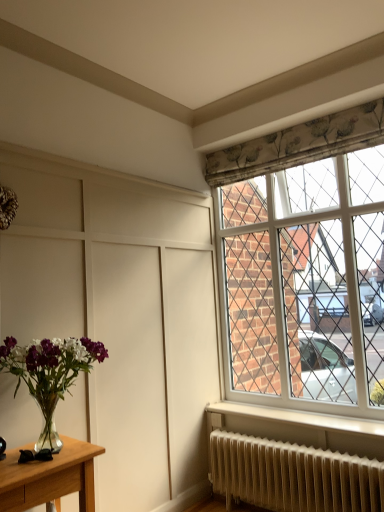
In order to face clear glass vase at lower left, should I rotate leftwards or rightwards?

To face it directly, rotate left by 18.483 degrees.

Identify the location of white plastic window at upper right. (305, 263).

What do you see at coordinates (305, 263) in the screenshot? Image resolution: width=384 pixels, height=512 pixels. I see `white plastic window at upper right` at bounding box center [305, 263].

Identify the location of clear glass vase at lower left. This screenshot has height=512, width=384. (50, 374).

From a real-world perspective, is white textured radiator at lower right over white plastic window at upper right?

No, from a real-world perspective, white textured radiator at lower right is not on top of white plastic window at upper right.

Looking at this image, which of these two, white textured radiator at lower right or white plastic window at upper right, is thinner?

white plastic window at upper right is thinner.

Is white textured radiator at lower right facing towards white plastic window at upper right?

No.

Considering the positions of points (288, 510) and (284, 374), is point (288, 510) closer to camera compared to point (284, 374)?

Yes, point (288, 510) is in front of point (284, 374).

Is clear glass vase at lower left not inside white plastic window at upper right?

Yes, clear glass vase at lower left is outside of white plastic window at upper right.

Which object is positioned more to the right, clear glass vase at lower left or white plastic window at upper right?

From the viewer's perspective, white plastic window at upper right appears more on the right side.

Is clear glass vase at lower left in front of or behind white plastic window at upper right in the image?

clear glass vase at lower left is in front of white plastic window at upper right.

Considering the relative sizes of white textured radiator at lower right and clear glass vase at lower left in the image provided, is white textured radiator at lower right bigger than clear glass vase at lower left?

Indeed, white textured radiator at lower right has a larger size compared to clear glass vase at lower left.

From the image's perspective, which is below, white textured radiator at lower right or clear glass vase at lower left?

white textured radiator at lower right appears lower in the image.

Can you confirm if white textured radiator at lower right is taller than clear glass vase at lower left?

Incorrect, the height of white textured radiator at lower right is not larger of that of clear glass vase at lower left.

Based on the photo, is white textured radiator at lower right spatially inside clear glass vase at lower left, or outside of it?

white textured radiator at lower right is outside clear glass vase at lower left.

Is white plastic window at upper right taller than clear glass vase at lower left?

Correct, white plastic window at upper right is much taller as clear glass vase at lower left.

Is clear glass vase at lower left surrounded by white plastic window at upper right?

No, clear glass vase at lower left is located outside of white plastic window at upper right.

Consider the image. Is white plastic window at upper right turned away from clear glass vase at lower left?

No, clear glass vase at lower left is not at the back of white plastic window at upper right.

From a real-world perspective, is white plastic window at upper right on top of clear glass vase at lower left?

Yes.

From the image's perspective, which one is positioned higher, clear glass vase at lower left or white textured radiator at lower right?

From the image's view, clear glass vase at lower left is above.

Based on the photo, from a real-world perspective, which is physically above, clear glass vase at lower left or white textured radiator at lower right?

In real-world perspective, clear glass vase at lower left is above.

Is clear glass vase at lower left turned away from white textured radiator at lower right?

No, clear glass vase at lower left's orientation is not away from white textured radiator at lower right.

Considering the sizes of objects white plastic window at upper right and white textured radiator at lower right in the image provided, who is shorter, white plastic window at upper right or white textured radiator at lower right?

white textured radiator at lower right is shorter.

Is white plastic window at upper right looking in the opposite direction of white textured radiator at lower right?

No, white plastic window at upper right's orientation is not away from white textured radiator at lower right.

Which object is further away from the camera, white plastic window at upper right or white textured radiator at lower right?

white plastic window at upper right is behind.

The height and width of the screenshot is (512, 384). What are the coordinates of `radiator below the white plastic window at upper right (from the image's perspective)` in the screenshot? It's located at (293, 476).

In the image, there is a clear glass vase at lower left. Where is `window above it (from the image's perspective)`? This screenshot has width=384, height=512. window above it (from the image's perspective) is located at coordinates 305,263.

Considering their positions, is white plastic window at upper right positioned further to white textured radiator at lower right than clear glass vase at lower left?

The object further to white textured radiator at lower right is clear glass vase at lower left.

Considering their positions, is clear glass vase at lower left positioned closer to white plastic window at upper right than white textured radiator at lower right?

Based on the image, white textured radiator at lower right appears to be nearer to white plastic window at upper right.

When comparing their distances from clear glass vase at lower left, does white textured radiator at lower right or white plastic window at upper right seem closer?

Based on the image, white textured radiator at lower right appears to be nearer to clear glass vase at lower left.

Considering their positions, is clear glass vase at lower left positioned closer to white textured radiator at lower right than white plastic window at upper right?

white plastic window at upper right is closer to white textured radiator at lower right.

Considering their positions, is white plastic window at upper right positioned further to clear glass vase at lower left than white textured radiator at lower right?

white plastic window at upper right.

Looking at the image, which one is located further to white plastic window at upper right, white textured radiator at lower right or clear glass vase at lower left?

clear glass vase at lower left lies further to white plastic window at upper right than the other object.

Locate an element on the screen. This screenshot has width=384, height=512. radiator located between clear glass vase at lower left and white plastic window at upper right in the left-right direction is located at coordinates [293, 476].